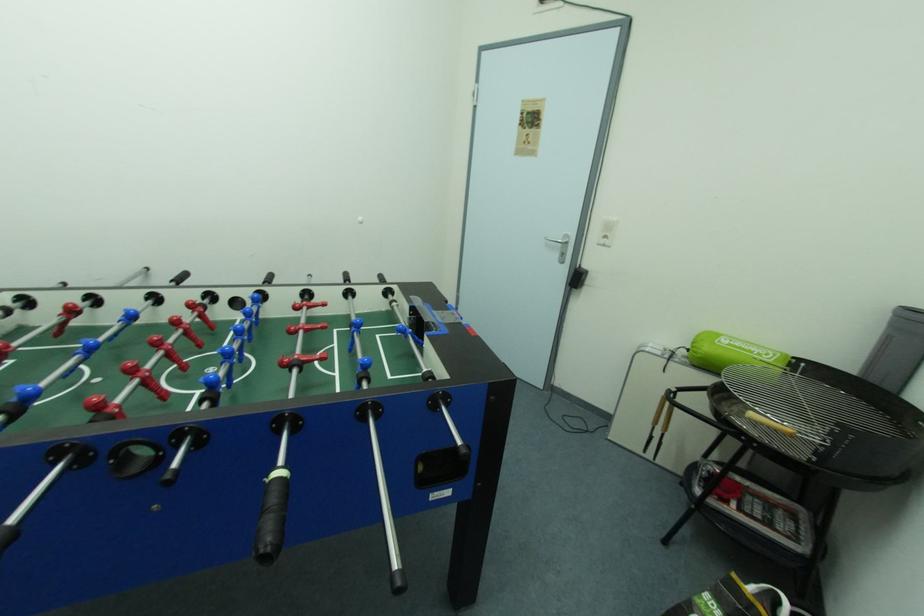
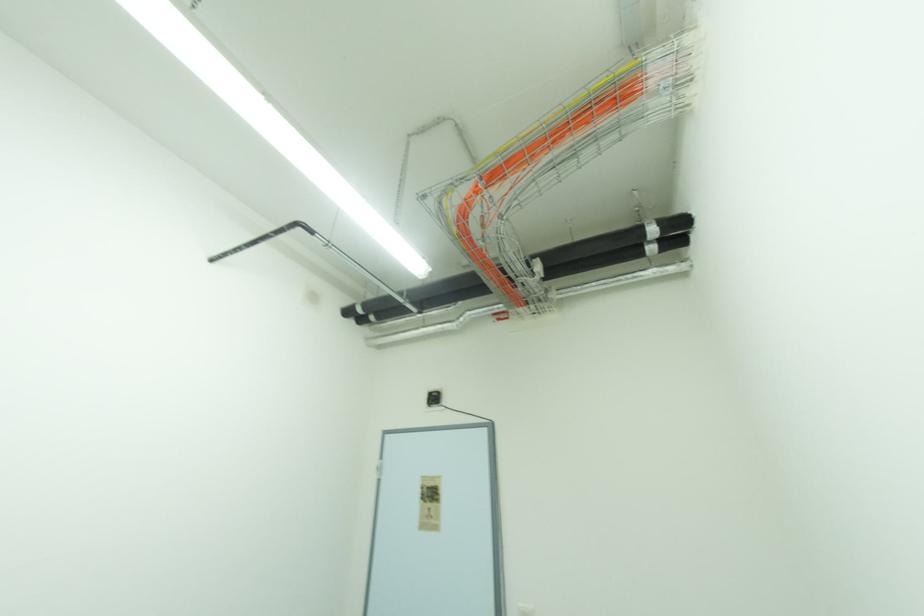
The images are taken continuously from a first-person perspective. In which direction is your viewpoint rotating?

The rotation direction of the camera is right-up.